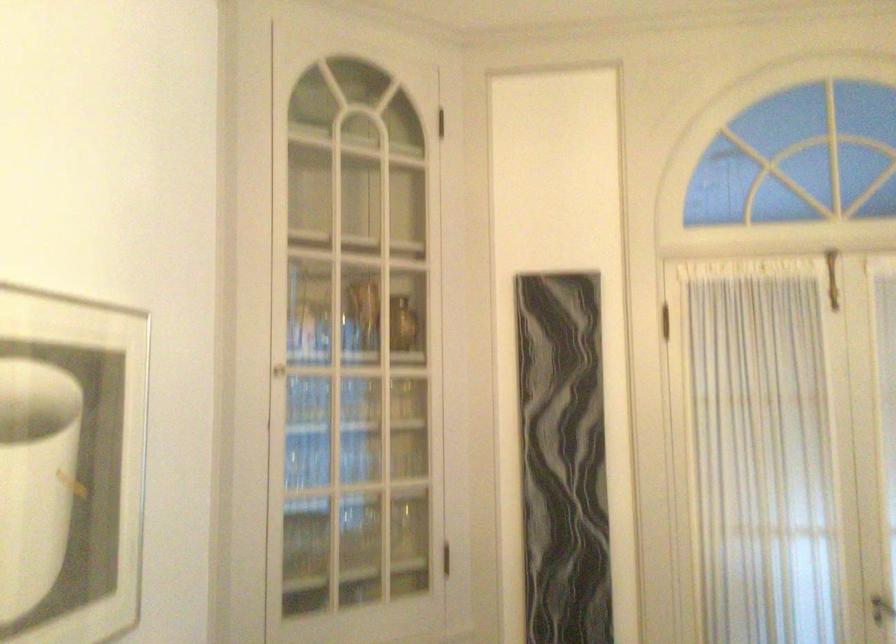
The width and height of the screenshot is (896, 644). I want to click on small cabinet knob, so click(x=279, y=371).